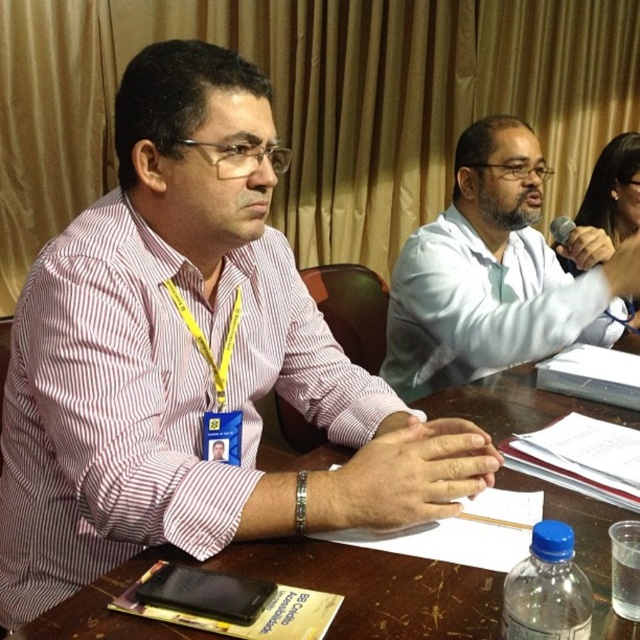
Does pink striped shirt at left have a smaller size compared to white matte shirt at center?

Actually, pink striped shirt at left might be larger than white matte shirt at center.

Is pink striped shirt at left below white matte shirt at center?

Yes.

Locate an element on the screen. Image resolution: width=640 pixels, height=640 pixels. pink striped shirt at left is located at coordinates (189, 358).

The width and height of the screenshot is (640, 640). I want to click on pink striped shirt at left, so click(x=189, y=358).

Is point (481, 262) more distant than point (568, 588)?

Yes.

Measure the distance between white matte shirt at center and blue plastic bottle at bottom right.

white matte shirt at center and blue plastic bottle at bottom right are 37.51 inches apart from each other.

Which is behind, point (541, 346) or point (564, 524)?

The point (541, 346) is behind.

This screenshot has height=640, width=640. Find the location of `white matte shirt at center`. white matte shirt at center is located at coordinates point(496,273).

From the picture: Between blue plastic bottle at bottom right and metallic silver microphone at upper right, which one has more height?

blue plastic bottle at bottom right

Is blue plastic bottle at bottom right smaller than metallic silver microphone at upper right?

Yes, blue plastic bottle at bottom right is smaller than metallic silver microphone at upper right.

Where is `blue plastic bottle at bottom right`? This screenshot has width=640, height=640. blue plastic bottle at bottom right is located at coordinates (547, 589).